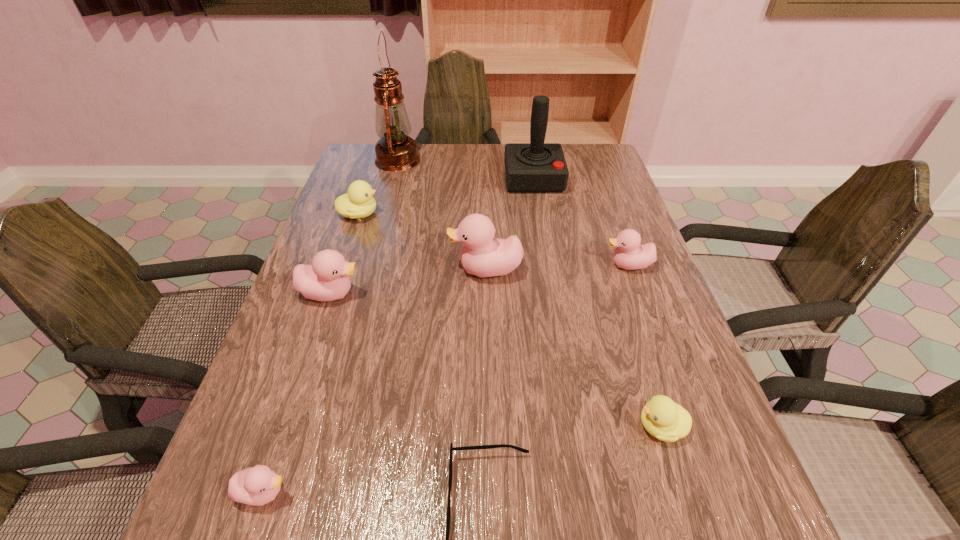
What are the coordinates of `vacant space in between the tallest duckling and the seventh farthest object` in the screenshot? It's located at (573, 348).

The image size is (960, 540). In order to click on free space between the red joystick and the third tallest object in this screenshot , I will do `click(510, 224)`.

Locate an element on the screen. free point between the seventh shortest object and the nearer yellow duckling is located at coordinates (573, 348).

You are a GUI agent. You are given a task and a screenshot of the screen. Output one action in this format:
    pyautogui.click(x=<x>, y=<y>)
    Task: Click on the free spot between the fifth farthest duckling and the smallest pink duckling
    The height and width of the screenshot is (540, 960).
    Given the screenshot: What is the action you would take?
    pyautogui.click(x=463, y=459)

Identify which object is the fifth nearest to the tallest duckling. Please provide its 2D coordinates. Your answer should be formatted as a tuple, i.e. [(x, y)], where the tuple contains the x and y coordinates of a point satisfying the conditions above.

[(667, 421)]

Locate an element on the screen. the closest object relative to the nearest pink duckling is located at coordinates (499, 445).

Find the location of a particular element. The image size is (960, 540). the third closest duckling relative to the black sunglasses is located at coordinates (327, 279).

Identify which duckling is located as the nearest to the oil lamp. Please provide its 2D coordinates. Your answer should be formatted as a tuple, i.e. [(x, y)], where the tuple contains the x and y coordinates of a point satisfying the conditions above.

[(358, 202)]

The width and height of the screenshot is (960, 540). What are the coordinates of `pink duckling that can be found as the second closest to the nearest duckling` in the screenshot? It's located at (482, 255).

Locate which pink duckling ranks third in proximity to the eighth shortest object. Please provide its 2D coordinates. Your answer should be formatted as a tuple, i.e. [(x, y)], where the tuple contains the x and y coordinates of a point satisfying the conditions above.

[(327, 279)]